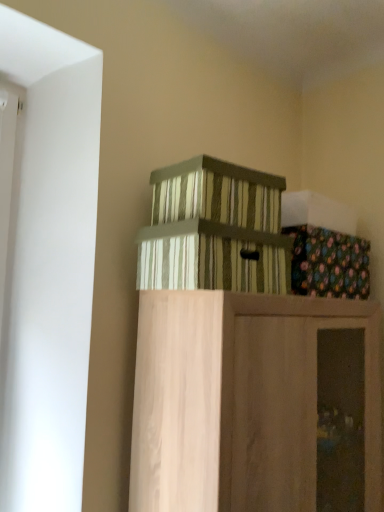
Question: Can you confirm if striped cardboard box at center, which is the 2th crate from top to bottom, is shorter than floral fabric box at upper right?

Choices:
 (A) yes
 (B) no

Answer: (B)

Question: From a real-world perspective, is striped cardboard box at center, placed as the first crate when sorted from bottom to top, physically below floral fabric box at upper right?

Choices:
 (A) yes
 (B) no

Answer: (A)

Question: Is striped cardboard box at center, which is the 2th crate from top to bottom, outside floral fabric box at upper right?

Choices:
 (A) yes
 (B) no

Answer: (A)

Question: Would you say striped cardboard box at center, which is the 2th crate from top to bottom, contains floral fabric box at upper right?

Choices:
 (A) no
 (B) yes

Answer: (A)

Question: Is there a large distance between striped cardboard box at center, which is the 2th crate from top to bottom, and floral fabric box at upper right?

Choices:
 (A) yes
 (B) no

Answer: (B)

Question: In the image, is wooden cabinet at upper center positioned in front of or behind floral fabric box at upper right?

Choices:
 (A) front
 (B) behind

Answer: (A)

Question: Visually, is wooden cabinet at upper center positioned to the left or to the right of floral fabric box at upper right?

Choices:
 (A) right
 (B) left

Answer: (B)

Question: Which is correct: wooden cabinet at upper center is inside floral fabric box at upper right, or outside of it?

Choices:
 (A) inside
 (B) outside

Answer: (B)

Question: Is wooden cabinet at upper center taller or shorter than floral fabric box at upper right?

Choices:
 (A) tall
 (B) short

Answer: (A)

Question: Relative to striped cardboard box at center, placed as the first crate when sorted from bottom to top, is wooden cabinet at upper center in front or behind?

Choices:
 (A) front
 (B) behind

Answer: (A)

Question: Visually, is wooden cabinet at upper center positioned to the left or to the right of striped cardboard box at center, which is the 2th crate from top to bottom?

Choices:
 (A) right
 (B) left

Answer: (A)

Question: From the image's perspective, is wooden cabinet at upper center above or below striped cardboard box at center, placed as the first crate when sorted from bottom to top?

Choices:
 (A) below
 (B) above

Answer: (A)

Question: Would you say wooden cabinet at upper center is inside or outside striped cardboard box at center, placed as the first crate when sorted from bottom to top?

Choices:
 (A) outside
 (B) inside

Answer: (A)

Question: From a real-world perspective, is striped cardboard crate at upper center, positioned as the 1th crate in top-to-bottom order, above or below wooden cabinet at upper center?

Choices:
 (A) below
 (B) above

Answer: (B)

Question: Which is correct: striped cardboard crate at upper center, arranged as the 2th crate when ordered from the bottom, is inside wooden cabinet at upper center, or outside of it?

Choices:
 (A) inside
 (B) outside

Answer: (B)